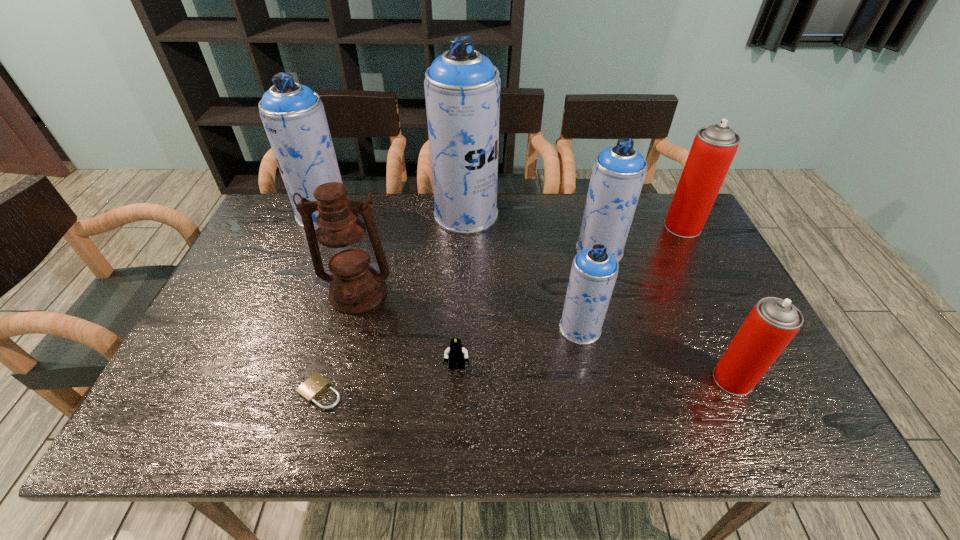
The image size is (960, 540). I want to click on the fifth farthest aerosol can, so click(594, 271).

This screenshot has width=960, height=540. I want to click on black Lego, so click(456, 353).

Identify the location of Lego. (456, 353).

The width and height of the screenshot is (960, 540). I want to click on padlock, so click(x=310, y=389).

Find the location of `the shortest object`. the shortest object is located at coordinates (310, 389).

The image size is (960, 540). I want to click on vacant region located on the front of the second blue aerosol can from left to right, so click(465, 245).

You are a GUI agent. You are given a task and a screenshot of the screen. Output one action in this format:
    pyautogui.click(x=<x>, y=<y>)
    Task: Click on the vacant space positioned on the front of the leftmost aerosol can
    
    Given the screenshot: What is the action you would take?
    [286, 305]

Locate an element on the screen. The image size is (960, 540). vacant space situated 0.220m on the front of the farther red aerosol can is located at coordinates (715, 289).

You are a GUI agent. You are given a task and a screenshot of the screen. Output one action in this format:
    pyautogui.click(x=<x>, y=<y>)
    Task: Click on the vacant area situated on the left of the third biggest blue aerosol can
    
    Given the screenshot: What is the action you would take?
    pyautogui.click(x=526, y=251)

Find the location of a particular element. The image size is (960, 540). vacant space located 0.140m on the right of the oil lamp is located at coordinates (445, 293).